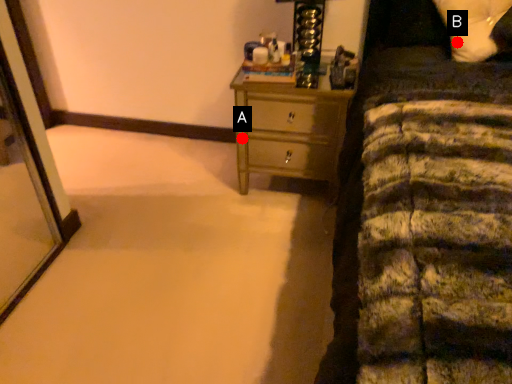
Question: Two points are circled on the image, labeled by A and B beside each circle. Among these points, which one is nearest to the camera?

Choices:
 (A) A is closer
 (B) B is closer

Answer: (B)